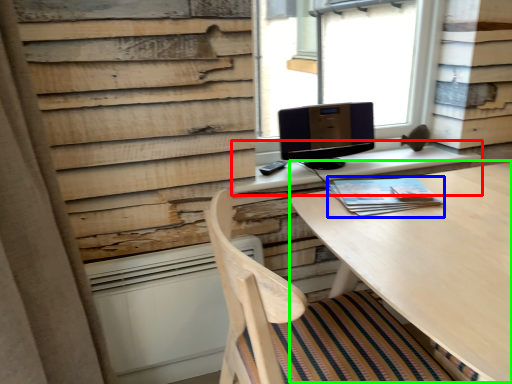
Question: Considering the real-world distances, which object is closest to table (highlighted by a red box)? book (highlighted by a blue box) or round table (highlighted by a green box).

Choices:
 (A) book
 (B) round table

Answer: (A)